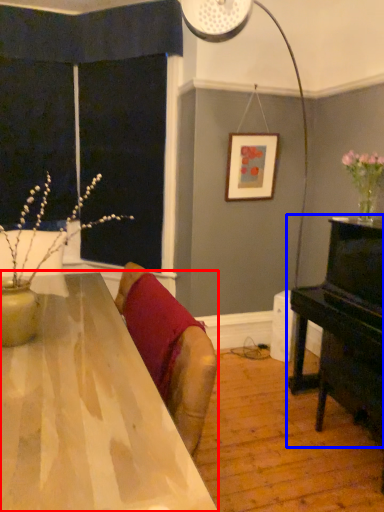
Question: Which of the following is the closest to the observer, table (highlighted by a red box) or piano (highlighted by a blue box)?

Choices:
 (A) table
 (B) piano

Answer: (A)